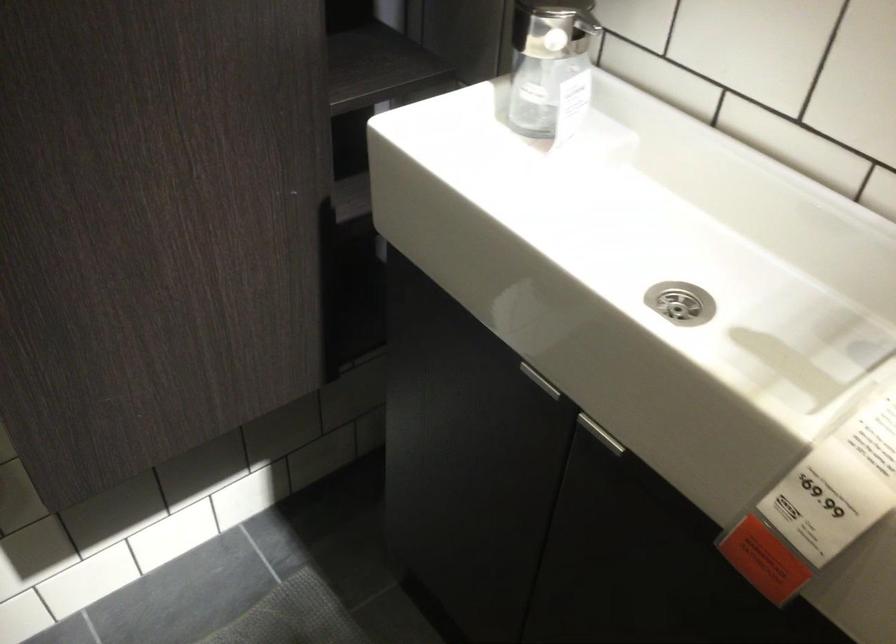
Where would you lift the white price tag? Please return your answer as a coordinate pair (x, y).

(826, 502)